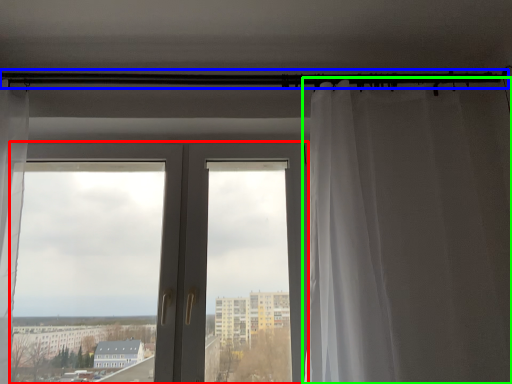
Question: Which is farther away from door (highlighted by a red box)? beam (highlighted by a blue box) or curtain (highlighted by a green box)?

Choices:
 (A) beam
 (B) curtain

Answer: (A)